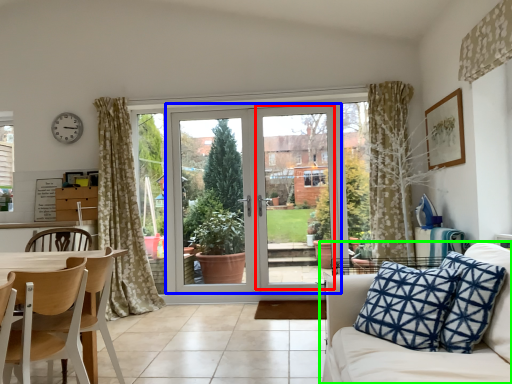
Question: Based on their relative distances, which object is nearer to screen door (highlighted by a red box)? Choose from door (highlighted by a blue box) and studio couch (highlighted by a green box).

Choices:
 (A) door
 (B) studio couch

Answer: (A)